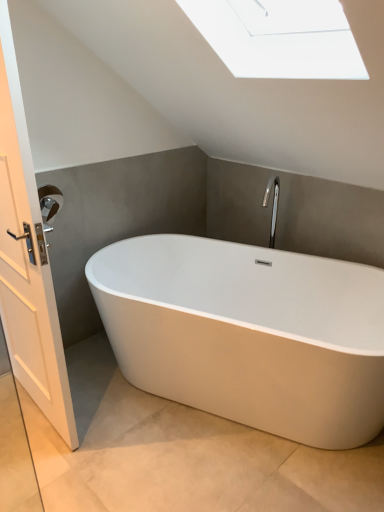
Question: In the image, is brushed metal towel bar at left positioned in front of or behind white wooden door at left?

Choices:
 (A) front
 (B) behind

Answer: (B)

Question: From a real-world perspective, is brushed metal towel bar at left above or below white wooden door at left?

Choices:
 (A) below
 (B) above

Answer: (B)

Question: Estimate the real-world distances between objects in this image. Which object is closer to the white glossy bathtub at center?

Choices:
 (A) white wooden door at left
 (B) brushed metal towel bar at left

Answer: (A)

Question: Estimate the real-world distances between objects in this image. Which object is closer to the white wooden door at left?

Choices:
 (A) white glossy bathtub at center
 (B) brushed metal towel bar at left

Answer: (B)